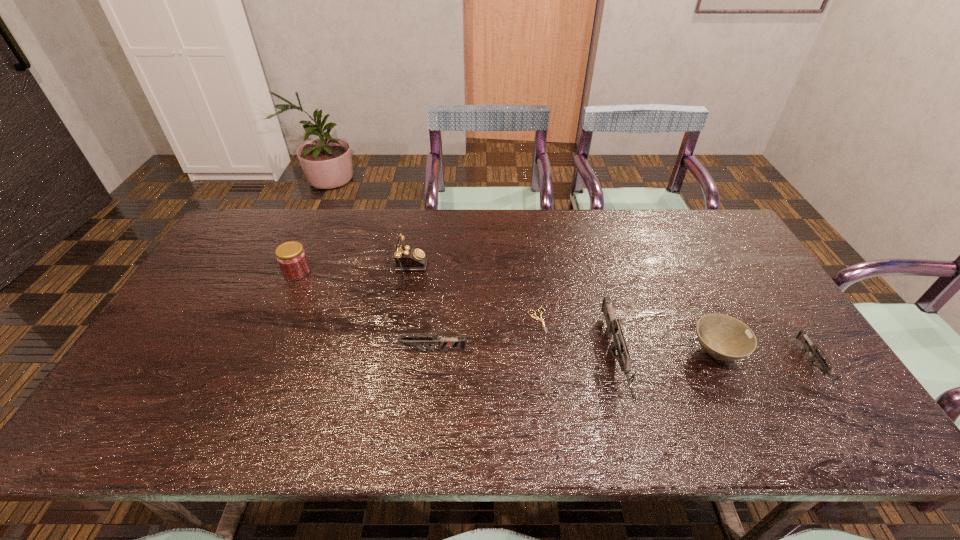
The image size is (960, 540). I want to click on free spot between the sixth object from left to right and the telephone, so click(x=556, y=316).

This screenshot has height=540, width=960. Identify the location of empty space that is in between the rightmost object and the fourth object from right to left. (676, 344).

You are a GUI agent. You are given a task and a screenshot of the screen. Output one action in this format:
    pyautogui.click(x=<x>, y=<y>)
    Task: Click on the free area in between the bowl and the sixth tallest object
    
    Given the screenshot: What is the action you would take?
    pos(765,360)

You are a GUI agent. You are given a task and a screenshot of the screen. Output one action in this format:
    pyautogui.click(x=<x>, y=<y>)
    Task: Click on the vacant space in between the rightmost object and the telephone
    This screenshot has height=540, width=960.
    Given the screenshot: What is the action you would take?
    pyautogui.click(x=605, y=323)

Find the location of a particular element. blank region between the jam and the second object from right to left is located at coordinates (507, 312).

Image resolution: width=960 pixels, height=540 pixels. Find the location of `free spot between the fifth object from left to right and the shortest gun`. free spot between the fifth object from left to right and the shortest gun is located at coordinates (714, 363).

Locate an element on the screen. object that is the sixth closest one to the bowl is located at coordinates (291, 257).

At what (x,y) coordinates should I click in order to perform the action: click on object that is the fifth closest to the leftmost object. Please return your answer as a coordinate pair (x, y). The height and width of the screenshot is (540, 960). Looking at the image, I should click on (723, 337).

Image resolution: width=960 pixels, height=540 pixels. Identify the location of gun that is the nearest to the sixth object from left to right. (802, 336).

Point out which gun is positioned as the nearest to the shears. Please provide its 2D coordinates. Your answer should be formatted as a tuple, i.e. [(x, y)], where the tuple contains the x and y coordinates of a point satisfying the conditions above.

[(613, 328)]